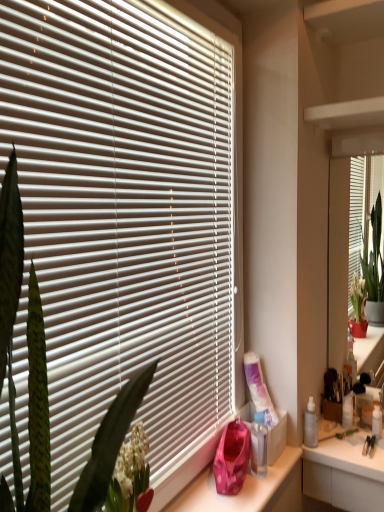
Question: Considering their positions, is green leafy plant at left located in front of or behind white glossy counter at lower right?

Choices:
 (A) front
 (B) behind

Answer: (A)

Question: Looking at the image, does green leafy plant at left seem bigger or smaller compared to white glossy counter at lower right?

Choices:
 (A) big
 (B) small

Answer: (A)

Question: Which object is positioned farthest from the translucent plastic spray bottle at right, the first toiletry positioned from the front?

Choices:
 (A) matte white mirror at right
 (B) clear plastic bottle at lower right
 (C) green leafy plant at left
 (D) white plastic bottle at right, which appears as the 1th toiletry when viewed from the right
 (E) white glossy counter at lower right

Answer: (C)

Question: Estimate the real-world distances between objects in this image. Which object is closer to the translucent plastic spray bottle at right, which is counted as the first toiletry, starting from the left?

Choices:
 (A) white plastic bottle at right, which is the 2th toiletry from left to right
 (B) clear plastic bottle at lower right
 (C) matte white mirror at right
 (D) green leafy plant at left
 (E) white plastic blinds at center

Answer: (A)